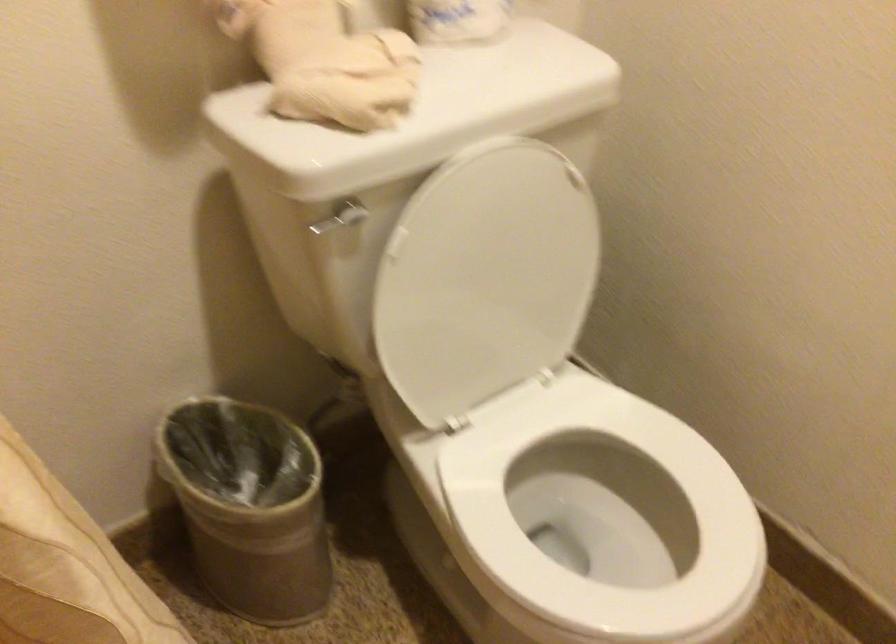
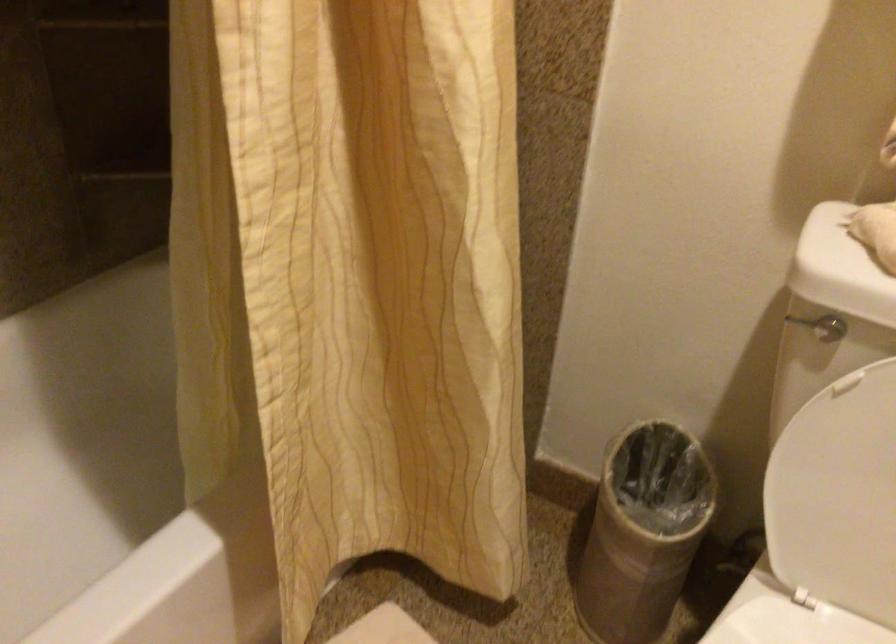
Question: The camera is either moving clockwise (left) or counter-clockwise (right) around the object. The first image is from the beginning of the video and the second image is from the end. Is the camera moving left or right when shooting the video?

Choices:
 (A) Left
 (B) Right

Answer: (B)